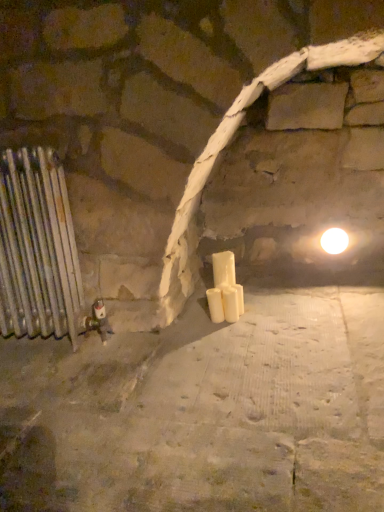
Question: Would you say white matte candle at center, acting as the 1th candle starting from the left, is inside or outside white matte candle at center, which ranks as the first candle in right-to-left order?

Choices:
 (A) outside
 (B) inside

Answer: (A)

Question: From the image's perspective, is white matte candle at center, arranged as the second candle when viewed from the right, above or below white matte candle at center, placed as the 2th candle when sorted from left to right?

Choices:
 (A) above
 (B) below

Answer: (B)

Question: Estimate the real-world distances between objects in this image. Which object is closer to the white matte candle at center, which ranks as the first candle in right-to-left order?

Choices:
 (A) white matte candle at center, arranged as the second candle when viewed from the right
 (B) silver metallic radiator at left
 (C) white glossy light bulb at upper right

Answer: (A)

Question: Based on their relative distances, which object is farther from the white matte candle at center, which ranks as the first candle in right-to-left order?

Choices:
 (A) white glossy light bulb at upper right
 (B) silver metallic radiator at left
 (C) white matte candle at center, arranged as the second candle when viewed from the right

Answer: (B)